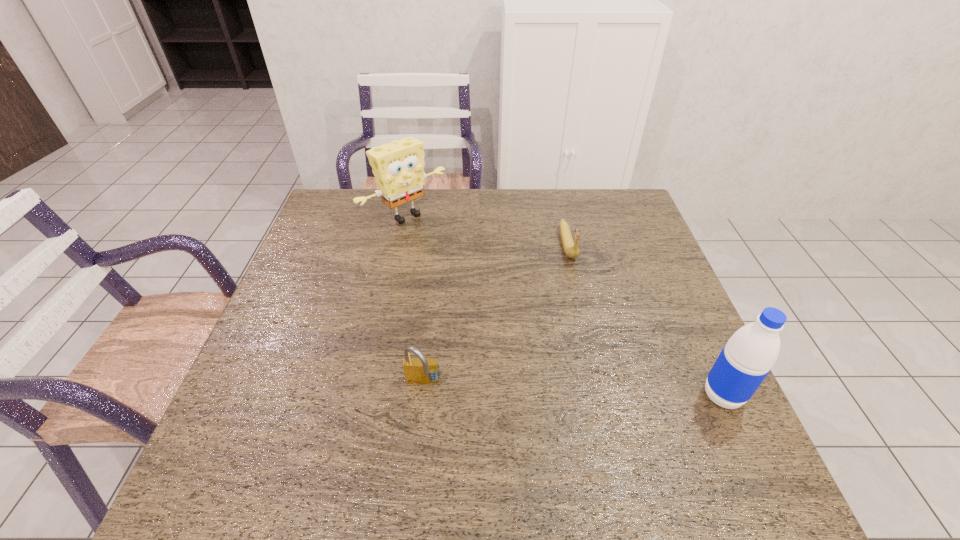
This screenshot has width=960, height=540. Find the location of `padlock`. padlock is located at coordinates (421, 370).

Locate an element on the screen. This screenshot has width=960, height=540. water bottle is located at coordinates [749, 355].

The width and height of the screenshot is (960, 540). I want to click on the second object from right to left, so click(x=571, y=249).

Identify the location of sponge. (398, 167).

Identify the location of vacant space located on the side with the combination dials of the padlock. The height and width of the screenshot is (540, 960). (418, 438).

Where is `vacant area located on the left of the rightmost object`? vacant area located on the left of the rightmost object is located at coordinates (604, 395).

Locate an element on the screen. The image size is (960, 540). vacant space situated at the stem of the banana is located at coordinates (597, 348).

In order to click on free region located 0.310m at the stem of the banana in this screenshot , I will do `click(599, 355)`.

Identify the location of vacant space positioned 0.270m at the stem of the banana. [595, 341].

You are a GUI agent. You are given a task and a screenshot of the screen. Output one action in this format:
    pyautogui.click(x=<x>, y=<y>)
    Task: Click on the vacant space located 0.340m on the face of the sponge
    
    Given the screenshot: What is the action you would take?
    pyautogui.click(x=499, y=292)